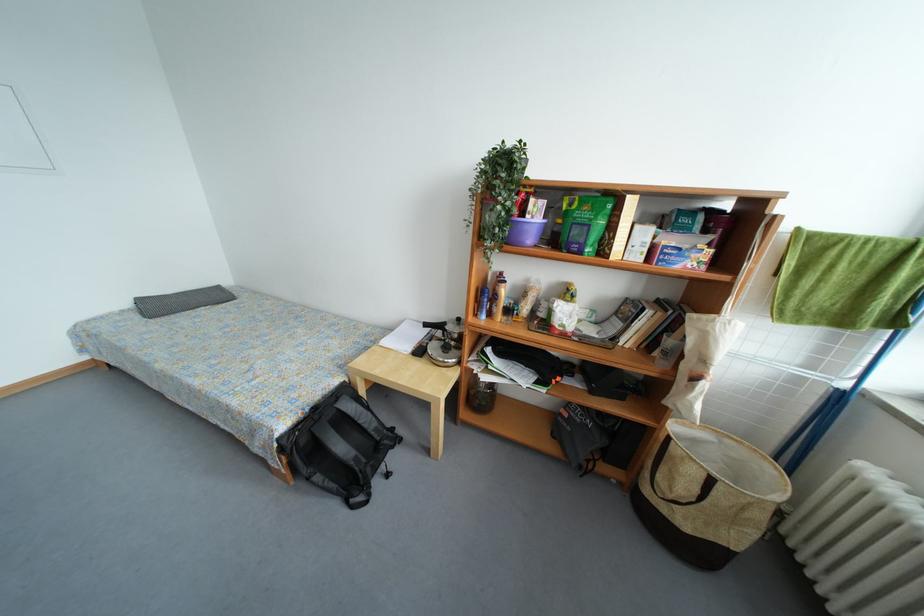
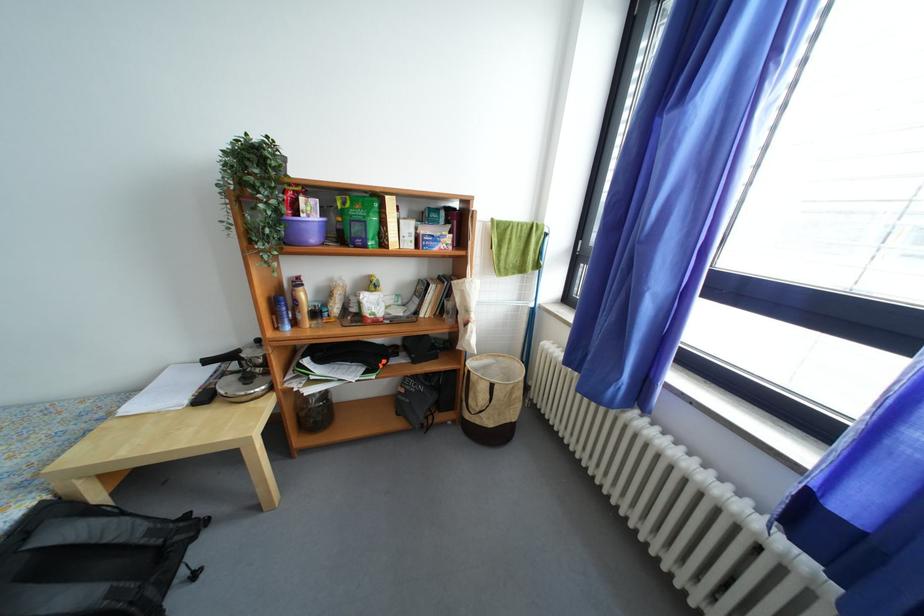
Where in the second image is the point corresponding to [515,315] from the first image?

(322, 318)